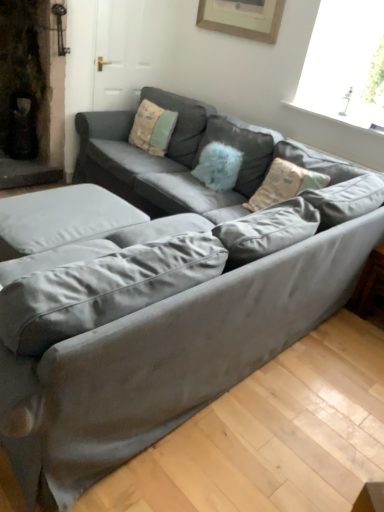
Locate an element on the screen. This screenshot has height=512, width=384. velvet beige pillow at center, which is counted as the 1th pillow, starting from the left is located at coordinates (152, 128).

You are a GUI agent. You are given a task and a screenshot of the screen. Output one action in this format:
    pyautogui.click(x=<x>, y=<y>)
    Task: Click on the wooden side table at lower right
    This screenshot has height=512, width=384.
    Given the screenshot: What is the action you would take?
    pyautogui.click(x=370, y=288)

What are the coordinates of `fluffy blue pillow at center, which is counted as the second pillow, starting from the left` in the screenshot? It's located at (241, 151).

Measure the distance between wooden picture frame at upper center and camera.

The depth of wooden picture frame at upper center is 9.72 feet.

What do you see at coordinates (242, 18) in the screenshot? This screenshot has height=512, width=384. I see `wooden picture frame at upper center` at bounding box center [242, 18].

This screenshot has width=384, height=512. Find the location of `velvet beige pillow at center, arranged as the 2th pillow when viewed from the right`. velvet beige pillow at center, arranged as the 2th pillow when viewed from the right is located at coordinates (152, 128).

The height and width of the screenshot is (512, 384). I want to click on couch below the wooden picture frame at upper center (from a real-world perspective), so point(197,163).

Measure the distance between wooden picture frame at upper center and satin gray couch at center.

wooden picture frame at upper center and satin gray couch at center are 3.36 feet apart from each other.

In the scene shown: Does wooden picture frame at upper center have a greater width compared to satin gray couch at center?

Incorrect, the width of wooden picture frame at upper center does not surpass that of satin gray couch at center.

Which of these two, wooden picture frame at upper center or satin gray couch at center, stands taller?

With more height is satin gray couch at center.

Is wooden side table at lower right placed right next to fluffy blue pillow at center, which is counted as the second pillow, starting from the left?

No, wooden side table at lower right is not touching fluffy blue pillow at center, which is counted as the second pillow, starting from the left.

Consider the image. From a real-world perspective, is wooden side table at lower right over fluffy blue pillow at center, which is the first pillow from right to left?

Incorrect, from a real-world perspective, wooden side table at lower right is lower than fluffy blue pillow at center, which is the first pillow from right to left.

Does point (382, 303) come closer to viewer compared to point (227, 136)?

That is True.

Considering the sizes of objects wooden side table at lower right and fluffy blue pillow at center, which is counted as the second pillow, starting from the left, in the image provided, who is thinner, wooden side table at lower right or fluffy blue pillow at center, which is counted as the second pillow, starting from the left,?

Thinner between the two is fluffy blue pillow at center, which is counted as the second pillow, starting from the left.

Based on the photo, from the image's perspective, does fluffy blue pillow at center, which is the first pillow from right to left, appear higher than wooden side table at lower right?

Yes, from the image's perspective, fluffy blue pillow at center, which is the first pillow from right to left, is above wooden side table at lower right.

In terms of width, does fluffy blue pillow at center, which is counted as the second pillow, starting from the left, look wider or thinner when compared to wooden side table at lower right?

fluffy blue pillow at center, which is counted as the second pillow, starting from the left, is thinner than wooden side table at lower right.

Is fluffy blue pillow at center, which is the first pillow from right to left, oriented towards wooden side table at lower right?

No, fluffy blue pillow at center, which is the first pillow from right to left, is not turned towards wooden side table at lower right.

How different are the orientations of fluffy blue pillow at center, which is counted as the second pillow, starting from the left, and wooden side table at lower right in degrees?

The angular difference between fluffy blue pillow at center, which is counted as the second pillow, starting from the left, and wooden side table at lower right is 4.01 degrees.

In the scene shown: Considering the relative positions of wooden side table at lower right and satin gray couch at center in the image provided, is wooden side table at lower right to the left of satin gray couch at center from the viewer's perspective?

Incorrect, wooden side table at lower right is not on the left side of satin gray couch at center.

Is wooden side table at lower right far away from satin gray couch at center?

Yes, wooden side table at lower right and satin gray couch at center are quite far apart.

From a real-world perspective, is wooden side table at lower right on satin gray couch at center?

Actually, wooden side table at lower right is physically below satin gray couch at center in the real world.

Is wooden side table at lower right inside the boundaries of satin gray couch at center, or outside?

wooden side table at lower right is located beyond the bounds of satin gray couch at center.

Who is taller, satin gray couch at center or wooden picture frame at upper center?

satin gray couch at center.

How many degrees apart are the facing directions of satin gray couch at center and wooden picture frame at upper center?

The facing directions of satin gray couch at center and wooden picture frame at upper center are 0.311 degrees apart.

How much distance is there between satin gray couch at center and wooden picture frame at upper center?

satin gray couch at center and wooden picture frame at upper center are 3.36 feet apart from each other.

Does satin gray couch at center come behind wooden picture frame at upper center?

No, satin gray couch at center is closer to the viewer.

Is satin gray couch at center facing away from wooden side table at lower right?

satin gray couch at center is not turned away from wooden side table at lower right.

Measure the distance between satin gray couch at center and wooden side table at lower right.

They are 1.19 meters apart.

Is satin gray couch at center located outside wooden side table at lower right?

Absolutely, satin gray couch at center is external to wooden side table at lower right.

Which is more to the left, satin gray couch at center or wooden side table at lower right?

satin gray couch at center is more to the left.

Is velvet beige pillow at center, which is counted as the 1th pillow, starting from the left, at the back of satin gray couch at center?

Yes, satin gray couch at center's orientation is away from velvet beige pillow at center, which is counted as the 1th pillow, starting from the left.

From a real-world perspective, which object stands above the other?

From a 3D spatial view, velvet beige pillow at center, which is counted as the 1th pillow, starting from the left, is above.

This screenshot has width=384, height=512. I want to click on couch on the left of wooden picture frame at upper center, so click(197, 163).

This screenshot has width=384, height=512. I want to click on side table in front of the fluffy blue pillow at center, which is counted as the second pillow, starting from the left, so click(x=370, y=288).

When comparing their distances from fluffy blue pillow at center, which is counted as the second pillow, starting from the left, does velvet beige pillow at center, which is counted as the 1th pillow, starting from the left, or wooden picture frame at upper center seem closer?

velvet beige pillow at center, which is counted as the 1th pillow, starting from the left.

When comparing their distances from fluffy blue pillow at center, which is counted as the second pillow, starting from the left, does velvet beige pillow at center, arranged as the 2th pillow when viewed from the right, or wooden side table at lower right seem closer?

velvet beige pillow at center, arranged as the 2th pillow when viewed from the right, lies closer to fluffy blue pillow at center, which is counted as the second pillow, starting from the left, than the other object.

Looking at the image, which one is located further to wooden picture frame at upper center, velvet beige pillow at center, which is counted as the 1th pillow, starting from the left, or satin gray couch at center?

The object further to wooden picture frame at upper center is satin gray couch at center.

When comparing their distances from velvet beige pillow at center, which is counted as the 1th pillow, starting from the left, does wooden picture frame at upper center or wooden side table at lower right seem further?

Among the two, wooden side table at lower right is located further to velvet beige pillow at center, which is counted as the 1th pillow, starting from the left.

Estimate the real-world distances between objects in this image. Which object is further from satin gray couch at center, wooden side table at lower right or wooden picture frame at upper center?

wooden side table at lower right lies further to satin gray couch at center than the other object.

Looking at the image, which one is located closer to wooden picture frame at upper center, velvet beige pillow at center, which is counted as the 1th pillow, starting from the left, or fluffy blue pillow at center, which is the first pillow from right to left?

fluffy blue pillow at center, which is the first pillow from right to left, lies closer to wooden picture frame at upper center than the other object.

Looking at the image, which one is located further to wooden picture frame at upper center, satin gray couch at center or wooden side table at lower right?

Among the two, wooden side table at lower right is located further to wooden picture frame at upper center.

Based on their spatial positions, is satin gray couch at center or wooden side table at lower right further from fluffy blue pillow at center, which is the first pillow from right to left?

wooden side table at lower right.

Locate an element on the screen. The height and width of the screenshot is (512, 384). pillow between velvet beige pillow at center, which is counted as the 1th pillow, starting from the left, and wooden side table at lower right, in the horizontal direction is located at coordinates (241, 151).

At what (x,y) coordinates should I click in order to perform the action: click on couch between velvet beige pillow at center, arranged as the 2th pillow when viewed from the right, and wooden side table at lower right, in the horizontal direction. Please return your answer as a coordinate pair (x, y). Looking at the image, I should click on (197, 163).

Where is `couch between wooden picture frame at upper center and wooden side table at lower right from top to bottom`? couch between wooden picture frame at upper center and wooden side table at lower right from top to bottom is located at coordinates (197, 163).

Identify the location of pillow between wooden picture frame at upper center and fluffy blue pillow at center, which is counted as the second pillow, starting from the left, from top to bottom. The image size is (384, 512). (152, 128).